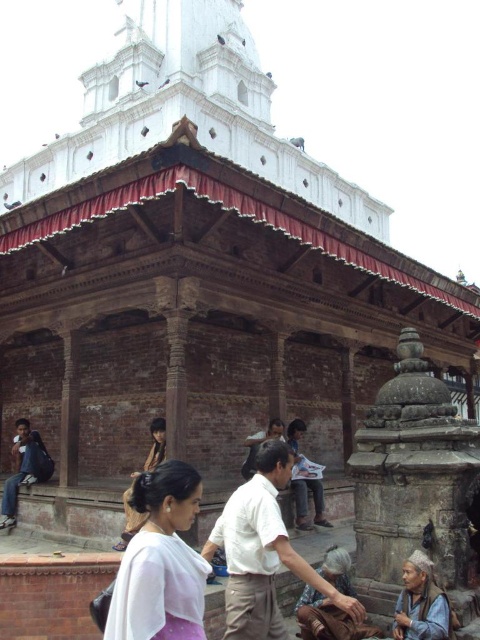
Does white cotton shirt at center appear under brown leather bag at lower center?

Actually, white cotton shirt at center is above brown leather bag at lower center.

Does white cotton shirt at center appear on the right side of brown leather bag at lower center?

Incorrect, white cotton shirt at center is not on the right side of brown leather bag at lower center.

Between point (237, 582) and point (326, 564), which one is positioned in front?

Point (237, 582)

The width and height of the screenshot is (480, 640). In order to click on white cotton shirt at center in this screenshot , I will do `click(263, 552)`.

Which of these two, white fabric at center or white paper at center, stands taller?

Standing taller between the two is white fabric at center.

Is white fabric at center smaller than white paper at center?

Incorrect, white fabric at center is not smaller in size than white paper at center.

Describe the element at coordinates (160, 561) in the screenshot. This screenshot has height=640, width=480. I see `white fabric at center` at that location.

Identify the location of white fabric at center. [160, 561].

You are a GUI agent. You are given a task and a screenshot of the screen. Output one action in this format:
    pyautogui.click(x=<x>, y=<y>)
    Task: Click on the brown leather bag at lower center
    Image resolution: width=480 pixels, height=640 pixels.
    Given the screenshot: What is the action you would take?
    pyautogui.click(x=326, y=618)

Does point (327, 634) come farther from viewer compared to point (262, 433)?

No, it is in front of (262, 433).

At what (x,y) coordinates should I click in order to perform the action: click on brown leather bag at lower center. Please return your answer as a coordinate pair (x, y). The height and width of the screenshot is (640, 480). Looking at the image, I should click on [326, 618].

Find the location of a particular element. brown leather bag at lower center is located at coordinates (x=326, y=618).